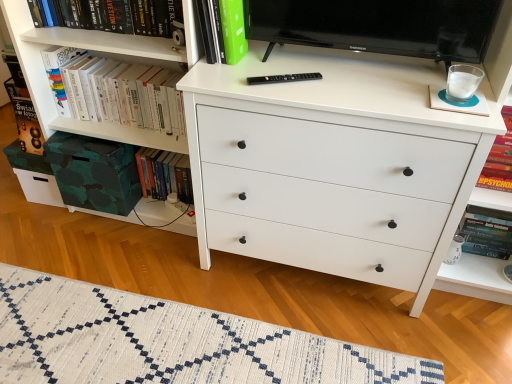
Question: From the image's perspective, does hardcover books at upper left appear lower than green matte book at upper center, which ranks as the 2th book in right-to-left order?

Choices:
 (A) no
 (B) yes

Answer: (A)

Question: Is hardcover books at upper left to the right of green matte book at upper center, the third book positioned from the left, from the viewer's perspective?

Choices:
 (A) no
 (B) yes

Answer: (A)

Question: From a real-world perspective, is hardcover books at upper left on top of green matte book at upper center, which ranks as the 2th book in right-to-left order?

Choices:
 (A) yes
 (B) no

Answer: (B)

Question: Is hardcover books at upper left oriented away from green matte book at upper center, which ranks as the 2th book in right-to-left order?

Choices:
 (A) yes
 (B) no

Answer: (B)

Question: From the image's perspective, is hardcover books at upper left on green matte book at upper center, the third book positioned from the left?

Choices:
 (A) no
 (B) yes

Answer: (B)

Question: In the image, is black glossy television at upper center positioned in front of or behind white matte chest of drawers at center?

Choices:
 (A) front
 (B) behind

Answer: (B)

Question: From a real-world perspective, is black glossy television at upper center above or below white matte chest of drawers at center?

Choices:
 (A) above
 (B) below

Answer: (A)

Question: Do you think black glossy television at upper center is within white matte chest of drawers at center, or outside of it?

Choices:
 (A) outside
 (B) inside

Answer: (A)

Question: Looking at their shapes, would you say black glossy television at upper center is wider or thinner than white matte chest of drawers at center?

Choices:
 (A) wide
 (B) thin

Answer: (B)

Question: From the image's perspective, is black glossy television at upper center positioned above or below white woven rug at lower center?

Choices:
 (A) below
 (B) above

Answer: (B)

Question: From a real-world perspective, relative to white woven rug at lower center, is black glossy television at upper center vertically above or below?

Choices:
 (A) below
 (B) above

Answer: (B)

Question: From their relative heights in the image, would you say black glossy television at upper center is taller or shorter than white woven rug at lower center?

Choices:
 (A) short
 (B) tall

Answer: (B)

Question: Is black glossy television at upper center in front of or behind white woven rug at lower center in the image?

Choices:
 (A) behind
 (B) front

Answer: (A)

Question: Considering the positions of hardcover book at lower left, the 3th book in the right-to-left sequence, and hardcover book at right, positioned as the 1th book in right-to-left order, in the image, is hardcover book at lower left, the 3th book in the right-to-left sequence, wider or thinner than hardcover book at right, positioned as the 1th book in right-to-left order,?

Choices:
 (A) thin
 (B) wide

Answer: (A)

Question: From a real-world perspective, is hardcover book at lower left, the 2th book when ordered from left to right, physically located above or below hardcover book at right, positioned as the 1th book in right-to-left order?

Choices:
 (A) below
 (B) above

Answer: (A)